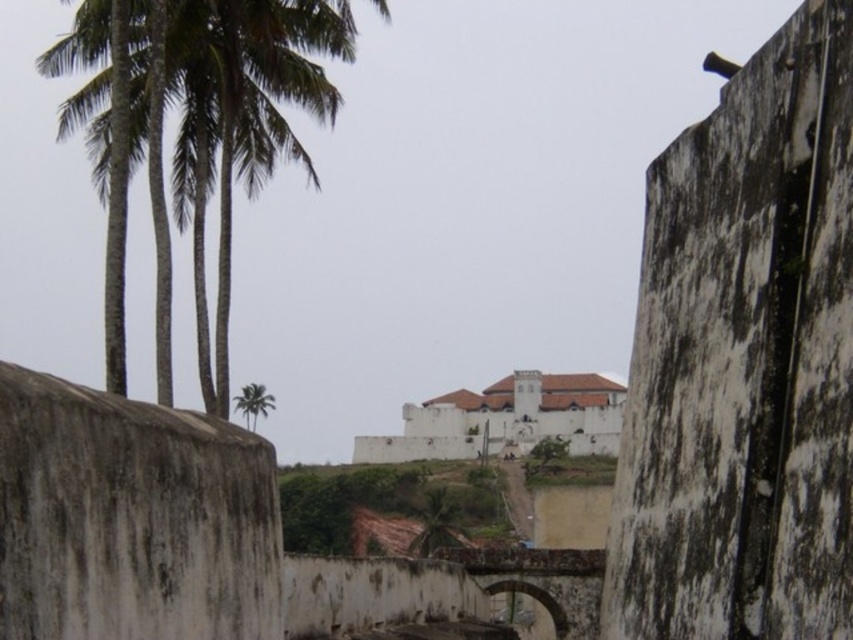
You are standing in the narrow passageway between the two weathered walls of the fortification. You notice two green leafy palm trees in the scene. Which one, the green leafy palm trees at left or the green leafy palm tree at upper left, is positioned higher up in the image?

The green leafy palm trees at left is located above the green leafy palm tree at upper left, so it is positioned higher up in the image.

You are standing in a narrow passageway between two weathered walls in a historical fortification. You notice a point marked at coordinates (x=206, y=140). What object is located at that point?

The point at coordinates (x=206, y=140) indicates green leafy palm trees at left.

You are standing in a narrow passageway between two old walls in a historical fortification. You notice two points marked on the ground ahead of you. The first point is at coordinates point (160,161), and the second is at point (250,426). Which point is closer to you as you stand at the entrance of the passageway?

Point (160,161) is closer to the viewer than point (250,426).